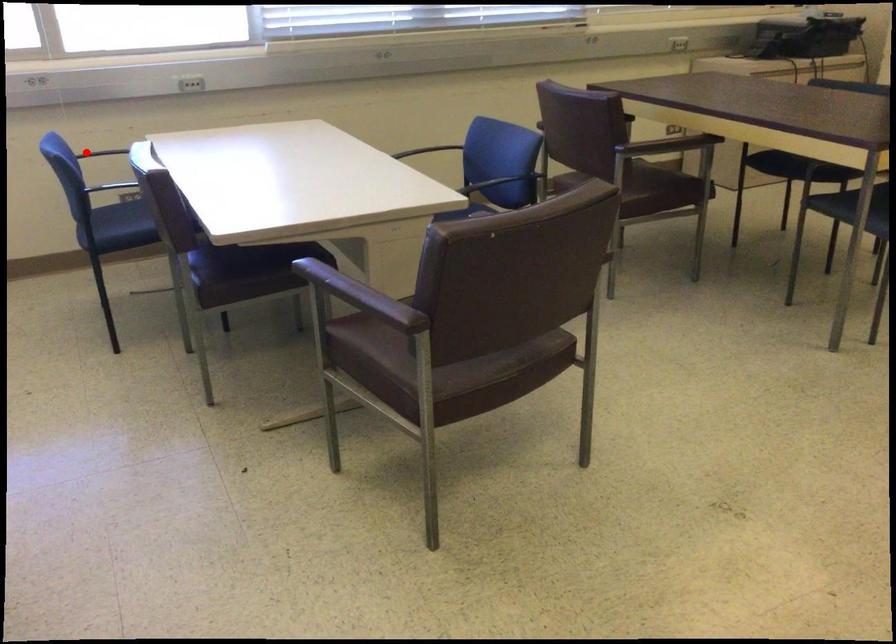
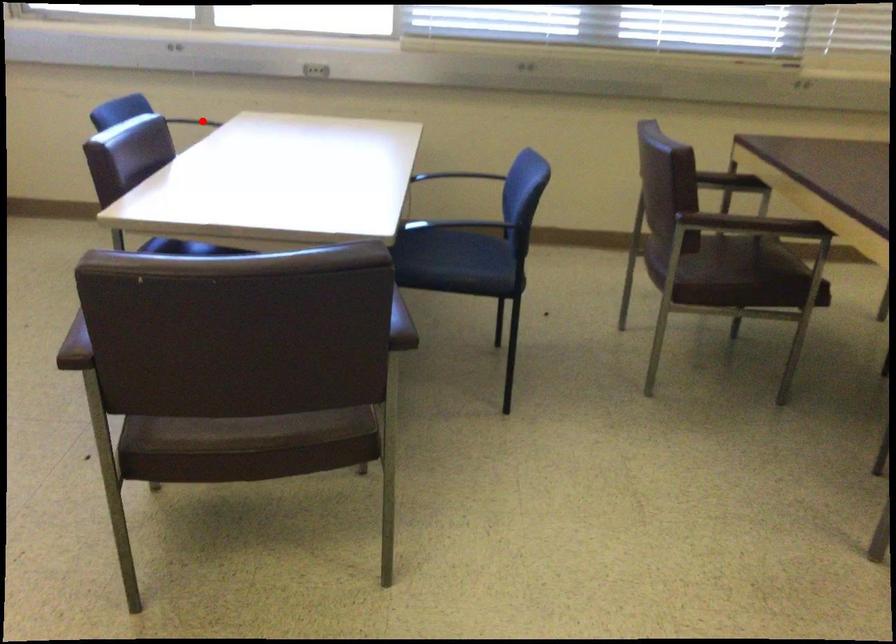
I am providing you with two images of the same scene from different viewpoints. A red point is marked on the first image and another point is marked on the second image. Do the highlighted points in image1 and image2 indicate the same real-world spot?

Yes